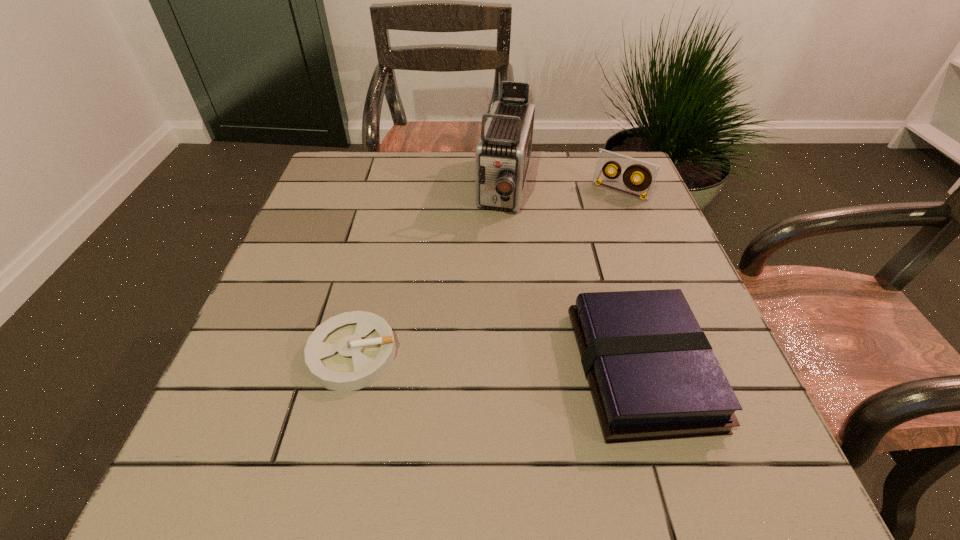
The width and height of the screenshot is (960, 540). In order to click on vacant space located 0.060m at the lens of the camcorder in this screenshot , I will do `click(498, 244)`.

Find the location of `vacant space located at the front of the videotape with visible reels`. vacant space located at the front of the videotape with visible reels is located at coordinates (561, 264).

Locate an element on the screen. free space located at the front of the videotape with visible reels is located at coordinates (538, 294).

I want to click on vacant space located 0.210m at the front of the videotape with visible reels, so click(x=576, y=244).

The height and width of the screenshot is (540, 960). I want to click on camcorder positioned at the far edge, so click(502, 158).

This screenshot has width=960, height=540. I want to click on videotape at the far edge, so click(x=647, y=172).

At what (x,y) coordinates should I click in order to perform the action: click on ashtray that is at the near edge. Please return your answer as a coordinate pair (x, y). Image resolution: width=960 pixels, height=540 pixels. Looking at the image, I should click on (349, 351).

Find the location of a particular element. book that is at the near edge is located at coordinates (652, 373).

The image size is (960, 540). Find the location of `object located at the left edge`. object located at the left edge is located at coordinates [x=349, y=351].

I want to click on book that is at the right edge, so click(x=652, y=373).